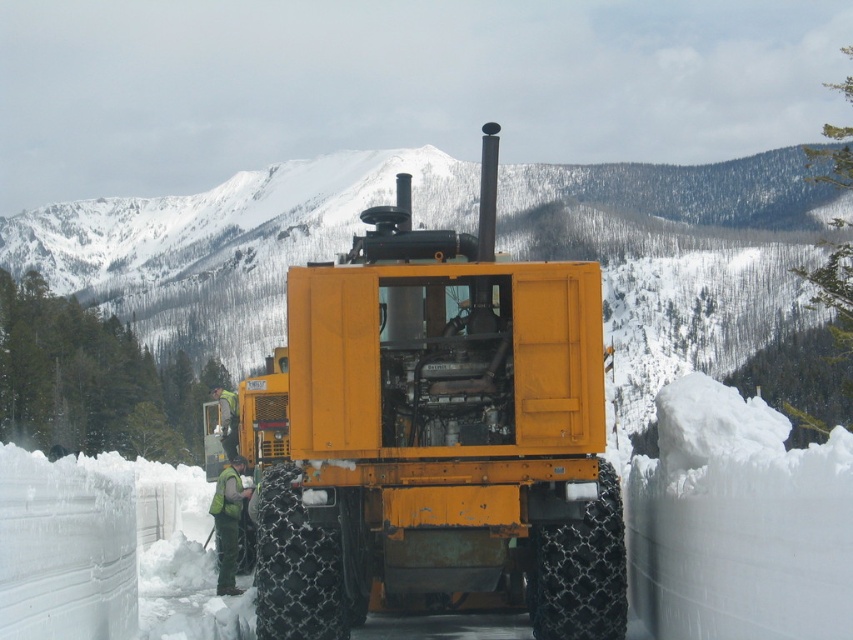
Question: Which object is closer to the camera taking this photo?

Choices:
 (A) green fabric jacket at center
 (B) black textured tire at lower center

Answer: (B)

Question: Estimate the real-world distances between objects in this image. Which object is closer to the black chain-link tire at center?

Choices:
 (A) green fabric jacket at center
 (B) matte yellow tractor at center
 (C) black textured tire at lower center
 (D) green fabric vest at center

Answer: (B)

Question: Can you confirm if black chain-link tire at center is positioned below green fabric vest at center?

Choices:
 (A) no
 (B) yes

Answer: (A)

Question: Which point is closer to the camera taking this photo?

Choices:
 (A) (494, 461)
 (B) (337, 621)

Answer: (A)

Question: Does matte yellow tractor at center have a lesser width compared to black chain-link tire at center?

Choices:
 (A) yes
 (B) no

Answer: (B)

Question: Is black textured tire at lower center positioned at the back of green fabric vest at center?

Choices:
 (A) no
 (B) yes

Answer: (A)